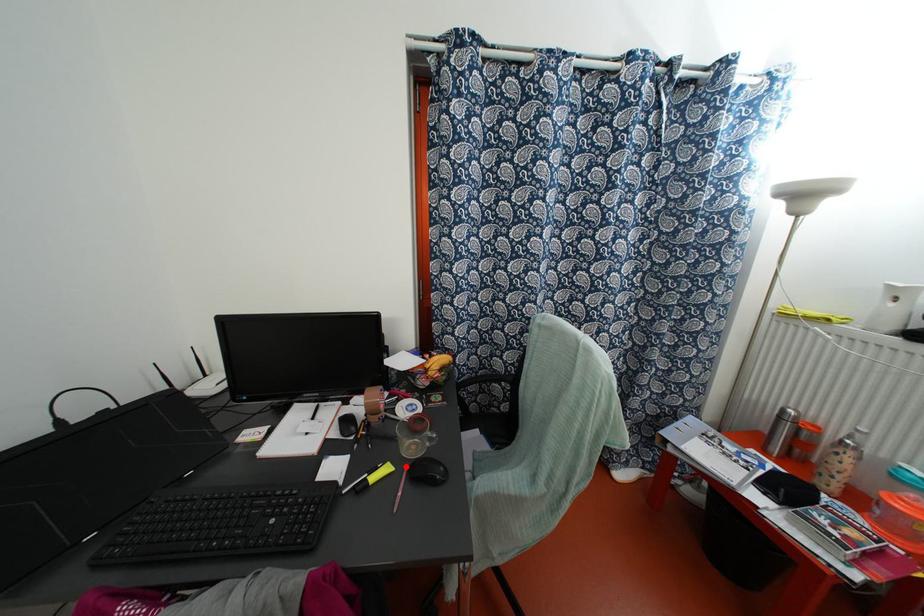
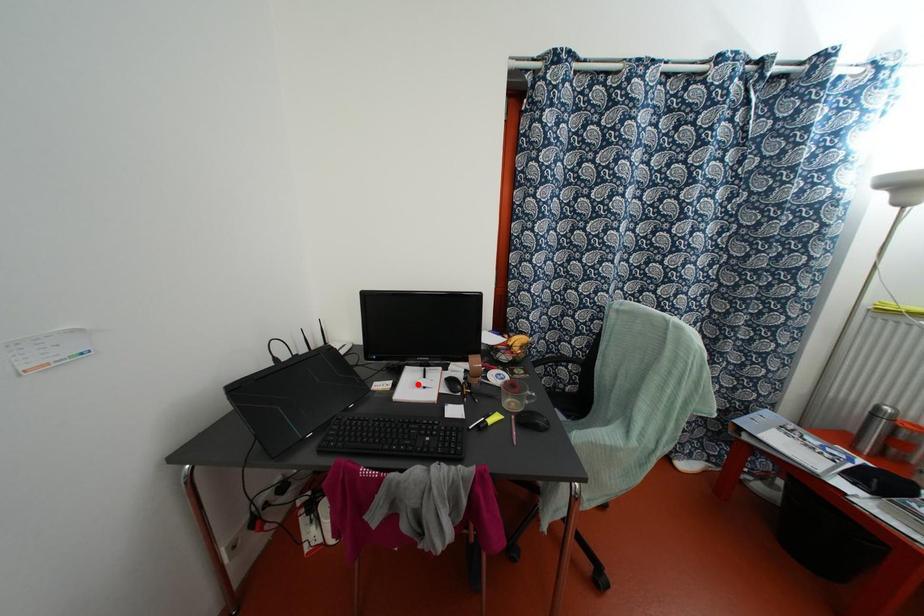
I am providing you with two images of the same scene from different viewpoints. A red point is marked on the first image and another point is marked on the second image. Are the points marked in image1 and image2 representing the same 3D position?

No